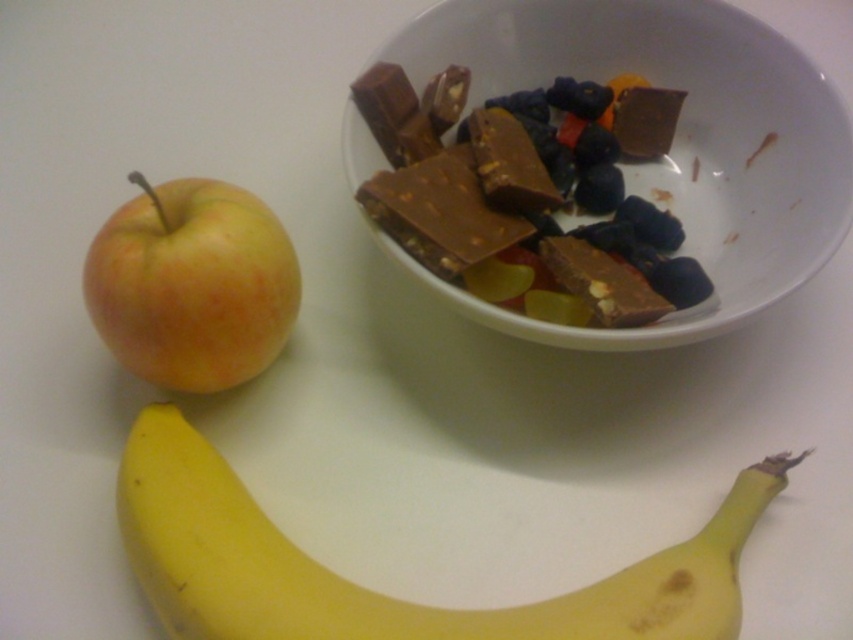
You have a small container that can only hold items narrower than the yellow matte apple at left. Can the matte brown chocolate bar at upper center fit into the container?

The yellow matte apple at left is wider than the matte brown chocolate bar at upper center, so the chocolate bar can fit into the container since it is narrower than the apple.

You are arranging snacks on a table and see the dark chocolate bar at upper center and the dark chocolate bar at center. Which one is positioned to the left?

The dark chocolate bar at upper center is to the left of the dark chocolate bar at center.